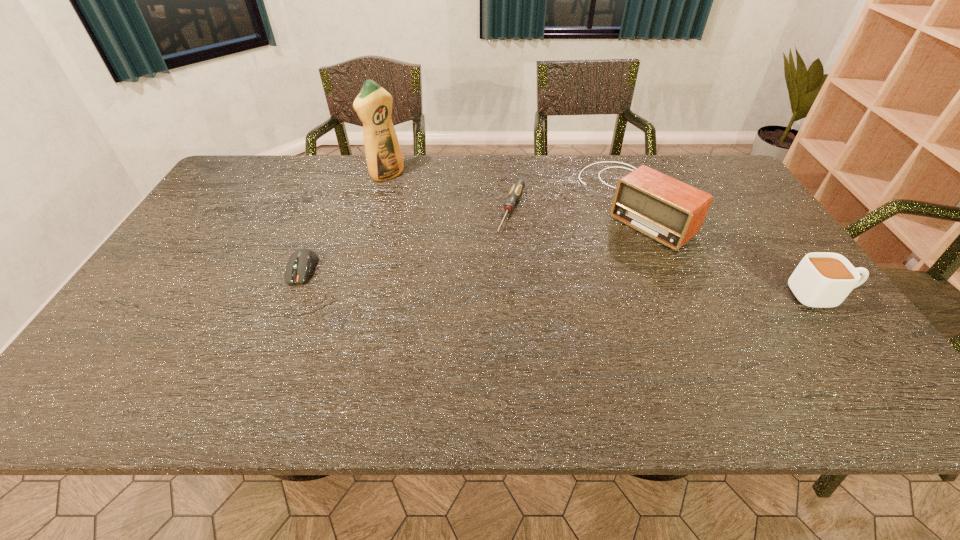
The width and height of the screenshot is (960, 540). Find the location of `blank region between the rightmost object and the third object from left to right`. blank region between the rightmost object and the third object from left to right is located at coordinates (666, 253).

Find the location of a particular element. The height and width of the screenshot is (540, 960). free point between the fourth object from right to left and the fourth shortest object is located at coordinates (510, 188).

The width and height of the screenshot is (960, 540). What are the coordinates of `unoccupied area between the third object from left to right and the computer equipment` in the screenshot? It's located at pos(407,240).

Find the location of a particular element. vacant point located between the fourth object from right to left and the second shortest object is located at coordinates (345, 222).

Identify the location of empty space that is in between the rightmost object and the fourth shortest object. The width and height of the screenshot is (960, 540). (727, 249).

Find the location of `free space between the computer equipment and the third object from left to right`. free space between the computer equipment and the third object from left to right is located at coordinates (407, 240).

Locate an element on the screen. unoccupied position between the screwdriver and the detergent is located at coordinates (449, 193).

The image size is (960, 540). I want to click on empty location between the third object from right to left and the leftmost object, so click(407, 240).

Image resolution: width=960 pixels, height=540 pixels. What are the coordinates of `free point between the third tallest object and the screwdriver` in the screenshot? It's located at (666, 253).

Image resolution: width=960 pixels, height=540 pixels. I want to click on vacant area that lies between the fourth object from left to right and the rightmost object, so click(727, 249).